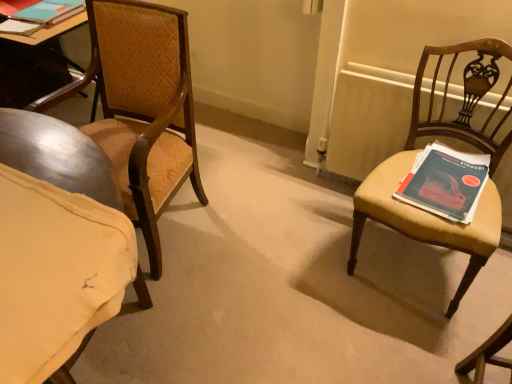
You are a GUI agent. You are given a task and a screenshot of the screen. Output one action in this format:
    pyautogui.click(x=<x>, y=<y>)
    Task: Click on the vacant space in between wooden textured chair at left, acting as the 1th chair starting from the left, and wooden radiator at right
    The height and width of the screenshot is (384, 512).
    Given the screenshot: What is the action you would take?
    pyautogui.click(x=264, y=225)